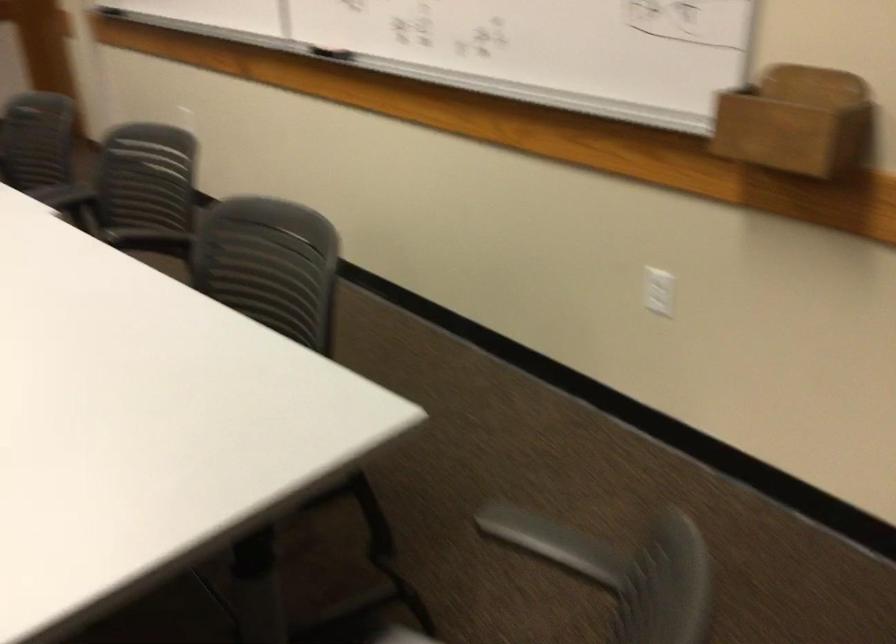
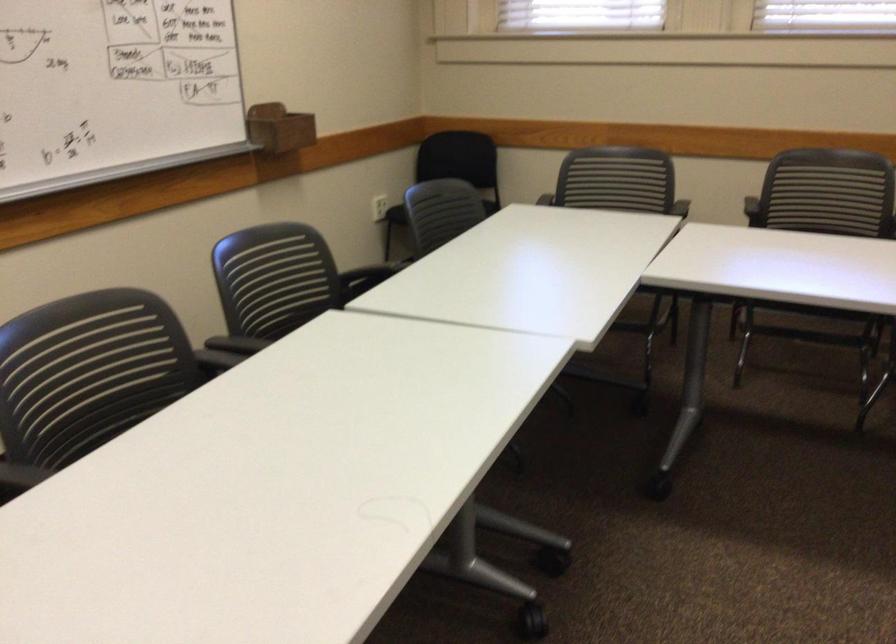
Question: I am providing you with two images of the same scene from different viewpoints. Please identify which objects are invisible in image2.

Choices:
 (A) piano pedal
 (B) wooden marker holder
 (C) chair sitting surface
 (D) black chair armrest

Answer: (C)